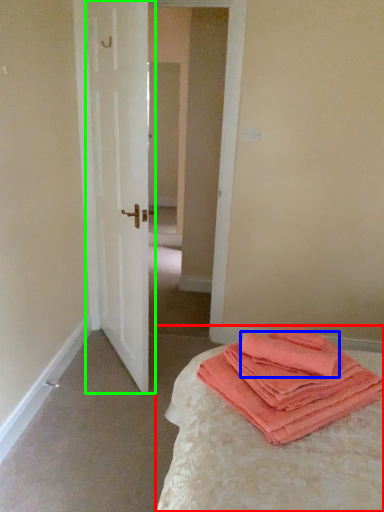
Question: Based on their relative distances, which object is farther from bed (highlighted by a red box)? Choose from cloth (highlighted by a blue box) and door (highlighted by a green box).

Choices:
 (A) cloth
 (B) door

Answer: (B)